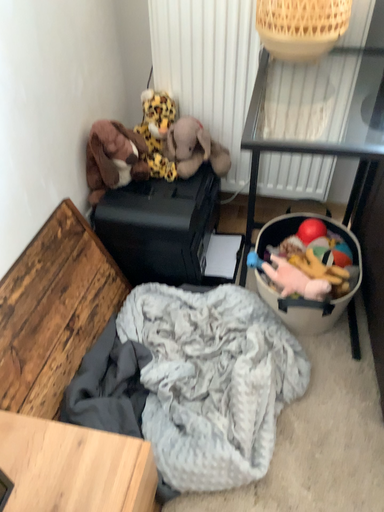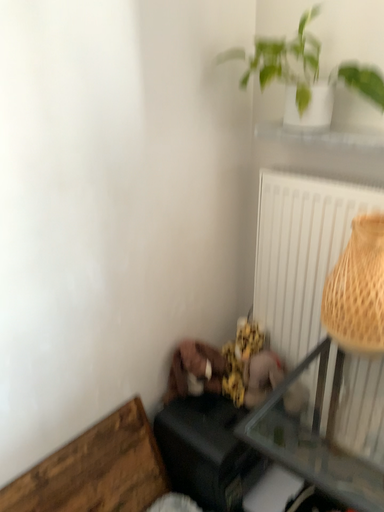
Question: How did the camera likely rotate when shooting the video?

Choices:
 (A) rotated downward
 (B) rotated upward

Answer: (B)